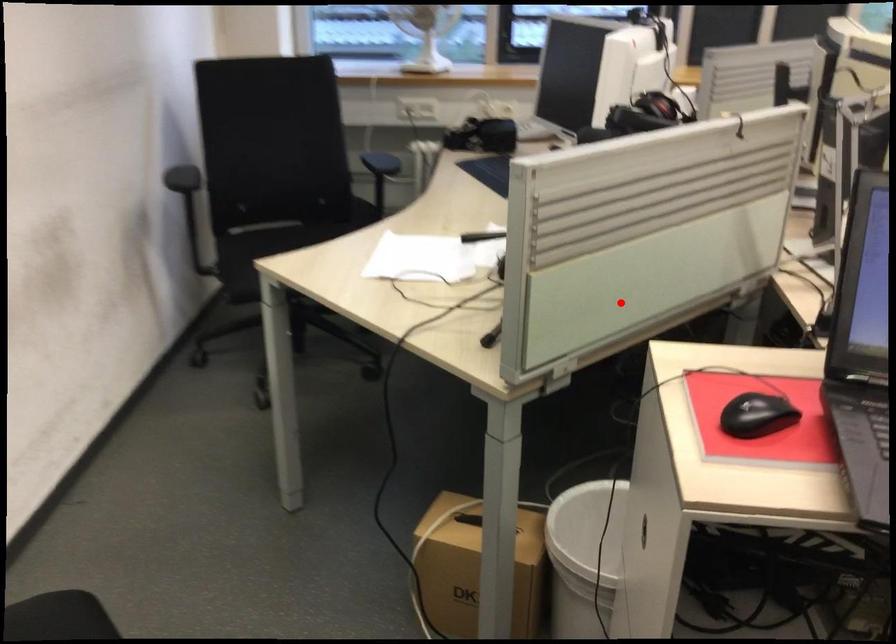
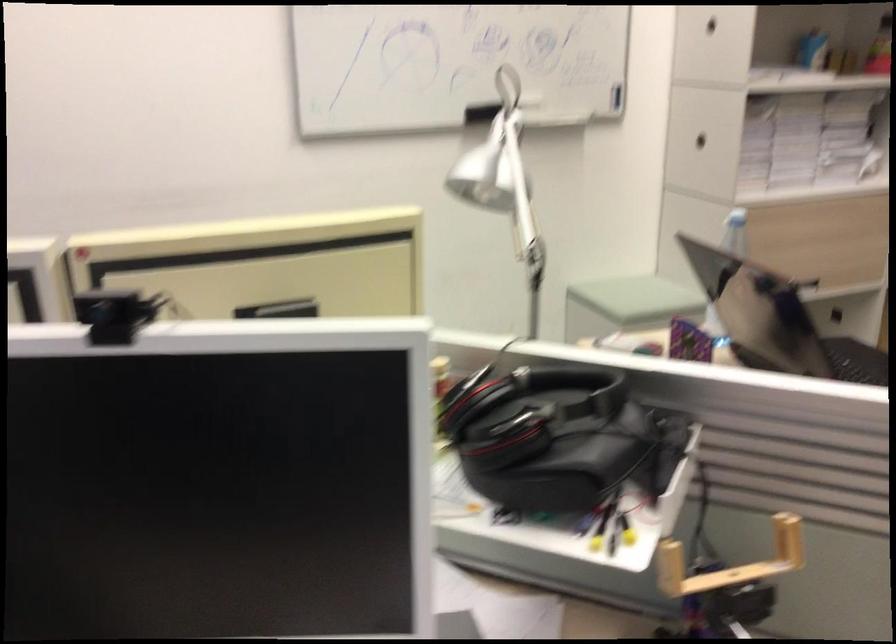
Where in the second image is the point corresponding to the highlighted location from the first image?

(730, 562)